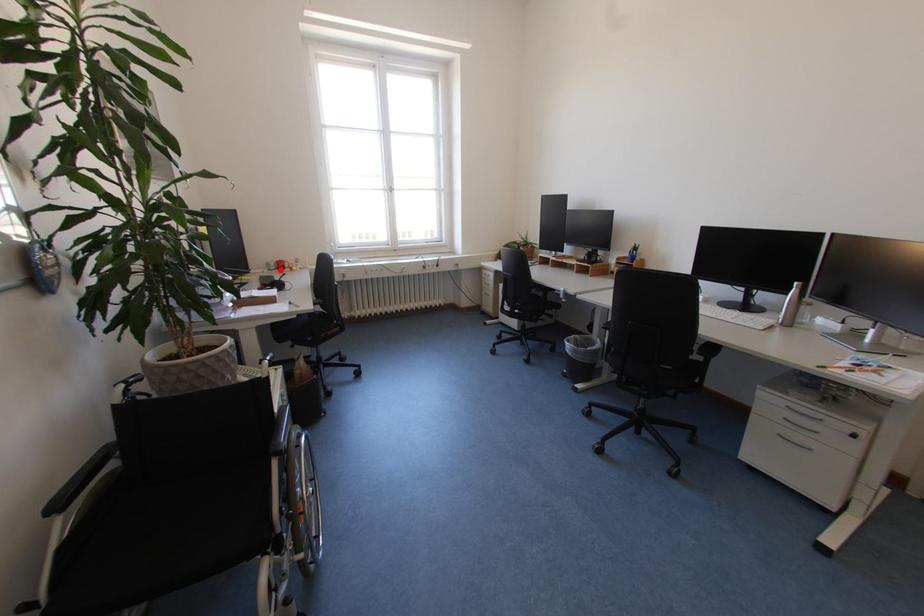
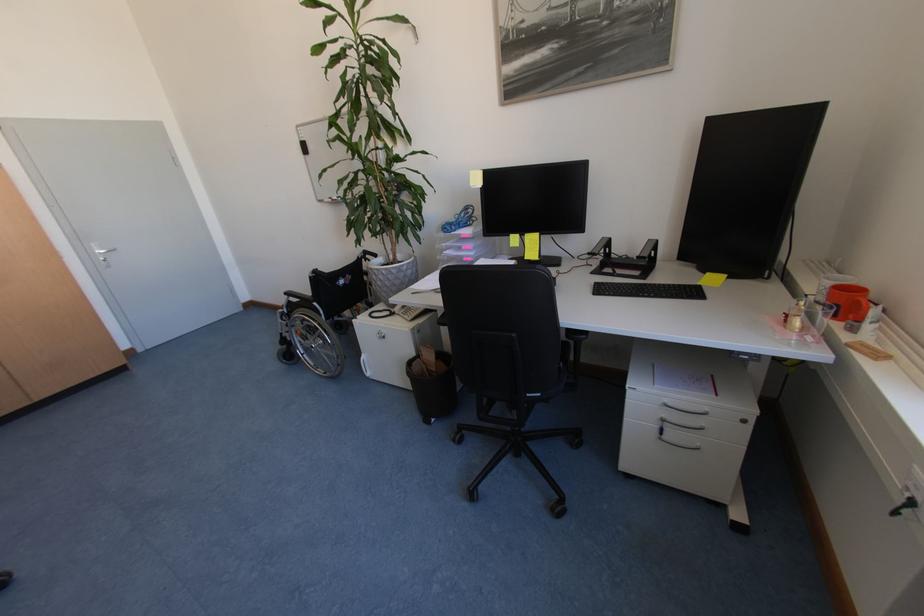
Question: I am providing you with two images of the same scene from different viewpoints. Image1 has a red point marked. In image2, the corresponding 3D location appears at what relative position? Reply with the corresponding letter.

Choices:
 (A) Closer
 (B) Farther

Answer: (B)